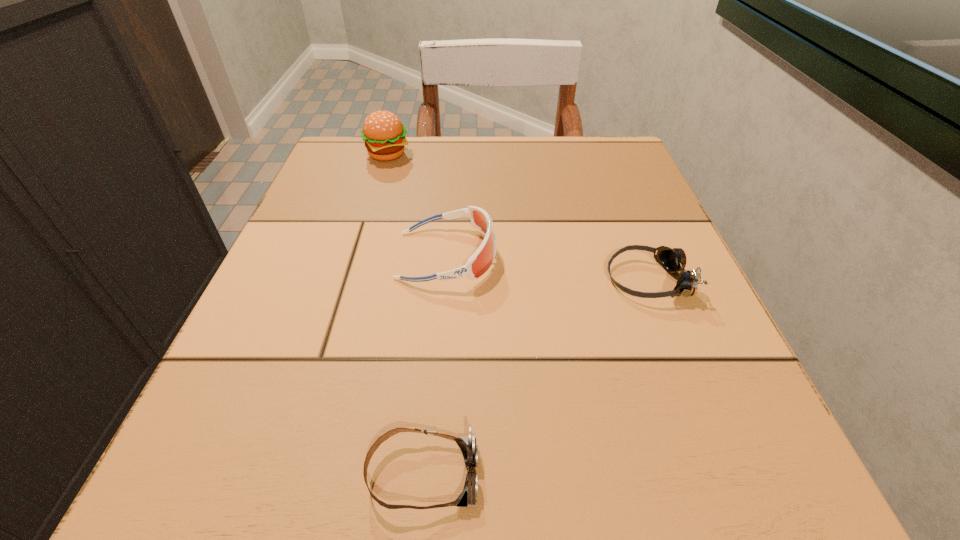
In the image, there is a desktop. In order to click on free space at the right edge in this screenshot , I will do `click(768, 427)`.

This screenshot has height=540, width=960. I want to click on free location at the near left corner of the desktop, so click(x=207, y=518).

The width and height of the screenshot is (960, 540). Identify the location of free region at the far right corner of the desktop. (619, 149).

At what (x,y) coordinates should I click in order to perform the action: click on free spot between the tallest goggles and the rightmost object. Please return your answer as a coordinate pair (x, y). Looking at the image, I should click on (547, 268).

You are a GUI agent. You are given a task and a screenshot of the screen. Output one action in this format:
    pyautogui.click(x=<x>, y=<y>)
    Task: Click on the free space that is in between the second shortest object and the nearest object
    
    Given the screenshot: What is the action you would take?
    pyautogui.click(x=536, y=377)

Identify the location of free space between the second shortest object and the tallest goggles. This screenshot has width=960, height=540. (547, 268).

Identify the location of vacant space that's between the second tallest goggles and the shortest goggles. (536, 377).

The image size is (960, 540). I want to click on free space between the tallest goggles and the rightmost goggles, so click(547, 268).

Find the location of `free spot between the shortest goggles and the second tallest object`. free spot between the shortest goggles and the second tallest object is located at coordinates (435, 365).

Where is `free space between the second tallest object and the rightmost object`? This screenshot has width=960, height=540. free space between the second tallest object and the rightmost object is located at coordinates (547, 268).